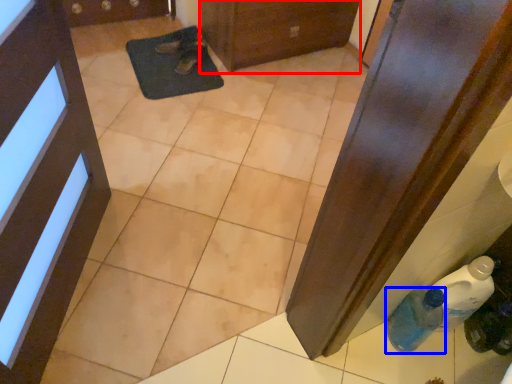
Question: Among these objects, which one is nearest to the camera, door (highlighted by a red box) or bottle (highlighted by a blue box)?

Choices:
 (A) door
 (B) bottle

Answer: (B)